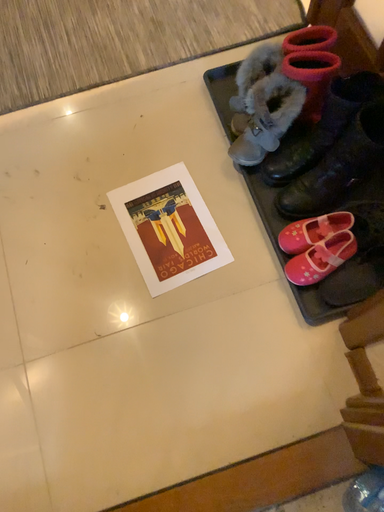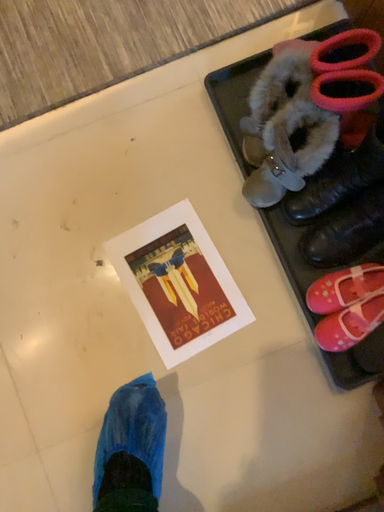
Question: How did the camera likely rotate when shooting the video?

Choices:
 (A) rotated upward
 (B) rotated downward

Answer: (B)